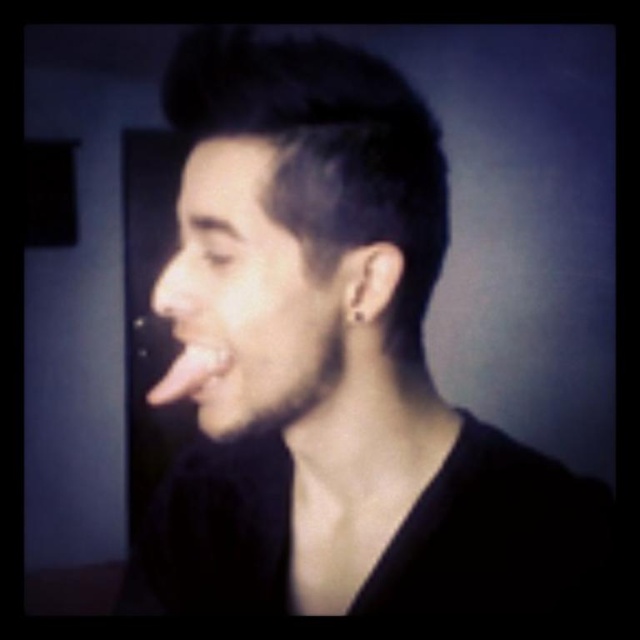
You are a photographer adjusting lighting for a portrait. The subject is wearing a matte black shirt at center and has a smooth skin face at center. You need to ensure that the distance between the shirt and face is at least 4 inches to avoid shadows overlapping. Is the current setup meeting this requirement?

The matte black shirt at center is 3.66 inches from the smooth skin face at center, which is less than the required 4 inches. The setup does not meet the requirement, so adjusting the distance would be necessary to prevent overlapping shadows.

You are a photographer adjusting lighting for a portrait. You notice the smooth skin face at center and the pink flesh at center in your frame. Which area requires more focused lighting to ensure proper exposure, considering their size difference?

The smooth skin face at center requires more focused lighting because it has a smaller size compared to the pink flesh at center, and smaller areas may need more precise lighting to avoid underexposure.

Looking at this image, you are a photographer adjusting lighting for a portrait. The subject is wearing a matte black shirt at center and has pink flesh at center. To ensure even lighting, you need to know which area is larger in the frame. Which one is wider?

The matte black shirt at center might be wider than pink flesh at center according to the description.